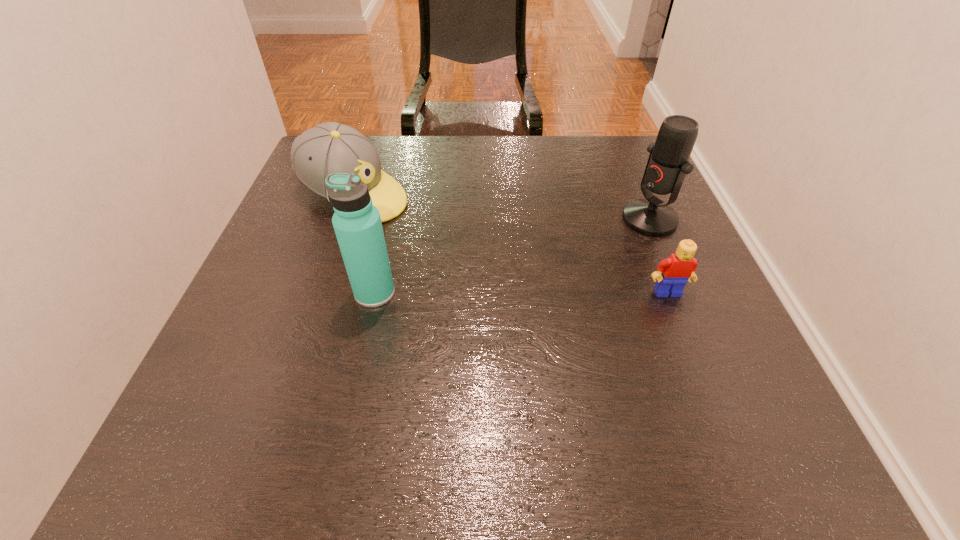
I want to click on thermos bottle, so click(357, 223).

Identify the location of Lego. (678, 268).

Identify the location of baseball cap. The height and width of the screenshot is (540, 960). (330, 147).

Locate an element on the screen. The width and height of the screenshot is (960, 540). microphone is located at coordinates (668, 163).

Image resolution: width=960 pixels, height=540 pixels. What are the coordinates of `free spot located on the right of the thermos bottle` in the screenshot? It's located at (451, 293).

You are a GUI agent. You are given a task and a screenshot of the screen. Output one action in this format:
    pyautogui.click(x=<x>, y=<y>)
    Task: Click on the free space located 0.050m on the face of the Lego
    This screenshot has height=540, width=960.
    Given the screenshot: What is the action you would take?
    pyautogui.click(x=678, y=319)

You are a GUI agent. You are given a task and a screenshot of the screen. Output one action in this format:
    pyautogui.click(x=<x>, y=<y>)
    Task: Click on the free region located 0.070m on the front-facing side of the baseball cap
    The width and height of the screenshot is (960, 540).
    Given the screenshot: What is the action you would take?
    pyautogui.click(x=418, y=223)

Find the location of a particular element. The width and height of the screenshot is (960, 540). free space located on the front-facing side of the baseball cap is located at coordinates (490, 258).

Where is `free space located on the front-facing side of the baseball cap`? Image resolution: width=960 pixels, height=540 pixels. free space located on the front-facing side of the baseball cap is located at coordinates (526, 276).

Identify the location of vacant space located 0.220m on the side of the microphone with the red ring. (552, 264).